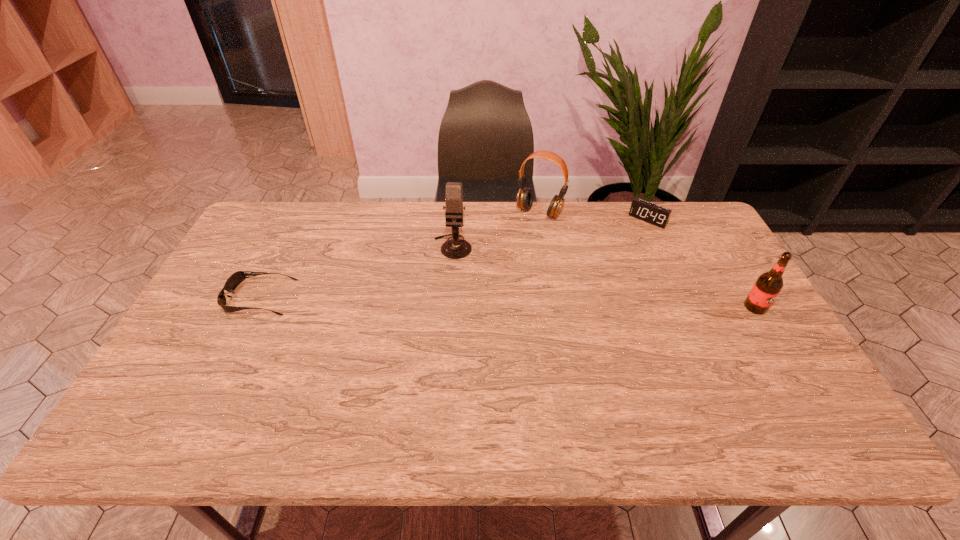
Where is `blank space at the far left corner`? blank space at the far left corner is located at coordinates [x=280, y=219].

At what (x,y) coordinates should I click in order to perform the action: click on blank area at the near left corner. Please return your answer as a coordinate pair (x, y). The height and width of the screenshot is (540, 960). Looking at the image, I should click on (200, 392).

Image resolution: width=960 pixels, height=540 pixels. I want to click on free point between the third object from right to left and the third nearest object, so click(x=496, y=229).

Where is `empty space that is in between the third object from left to right and the rightmost object`? empty space that is in between the third object from left to right and the rightmost object is located at coordinates (647, 259).

Locate an element on the screen. This screenshot has height=540, width=960. free area in between the third farthest object and the shortest object is located at coordinates (356, 272).

Identify the location of vacant space that's between the rightmost object and the headset. [647, 259].

Where is `vacant space in between the sunglasses and the root beer`? This screenshot has width=960, height=540. vacant space in between the sunglasses and the root beer is located at coordinates click(508, 302).

Where is `empty space between the alarm clock and the third farthest object`? This screenshot has width=960, height=540. empty space between the alarm clock and the third farthest object is located at coordinates (550, 233).

At what (x,y) coordinates should I click in order to perform the action: click on vacant space in between the leftmost object and the headset. Please return your answer as a coordinate pair (x, y). The image size is (960, 540). Looking at the image, I should click on (399, 255).

Locate which object ranks fourth in proximity to the root beer. Please provide its 2D coordinates. Your answer should be formatted as a tuple, i.e. [(x, y)], where the tuple contains the x and y coordinates of a point satisfying the conditions above.

[(234, 280)]